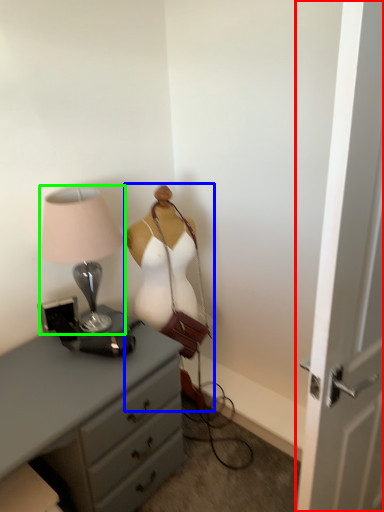
Question: Considering the real-world distances, which object is closest to door (highlighted by a red box)? mannequin (highlighted by a blue box) or lamp (highlighted by a green box).

Choices:
 (A) mannequin
 (B) lamp

Answer: (A)